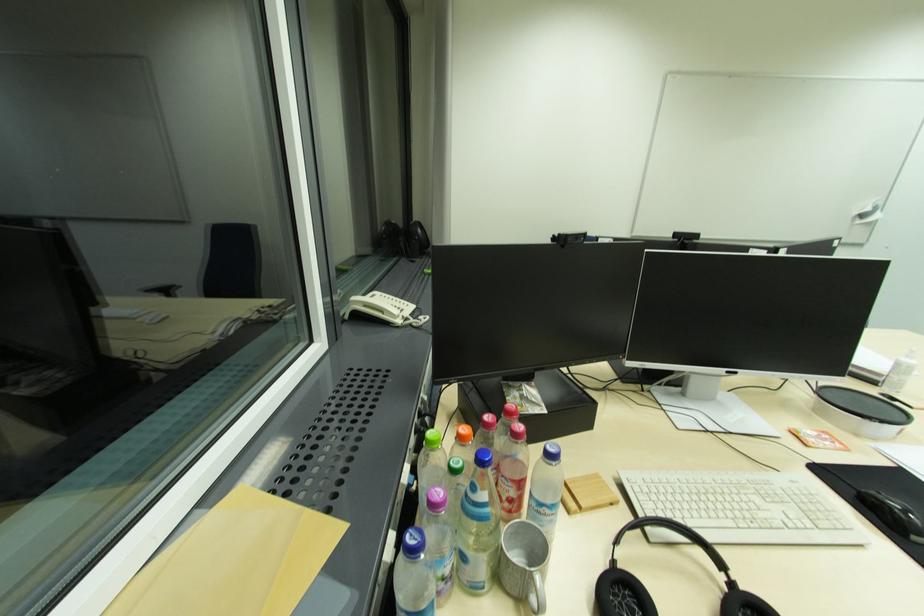
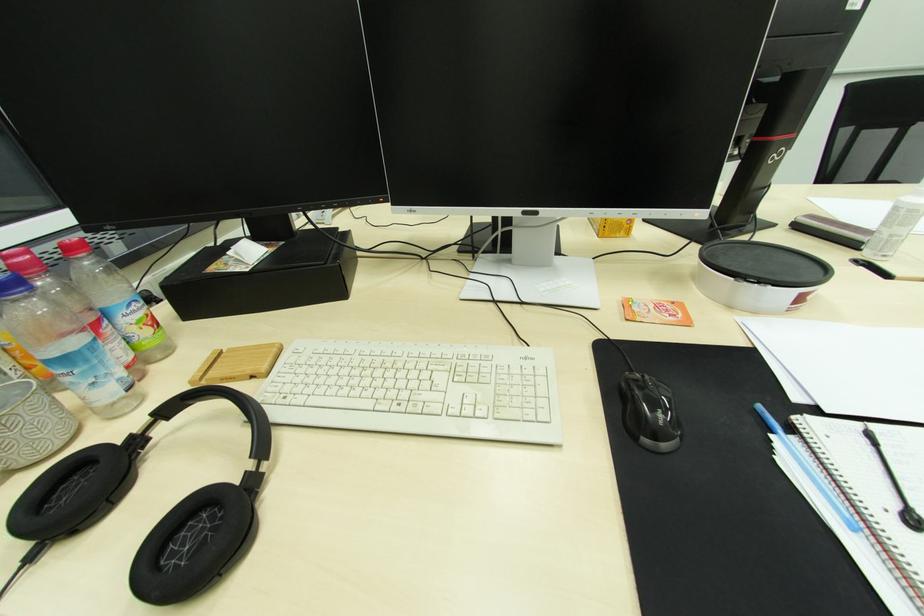
What movement of the cameraman would produce the second image?

The cameraman moved toward right, forward.